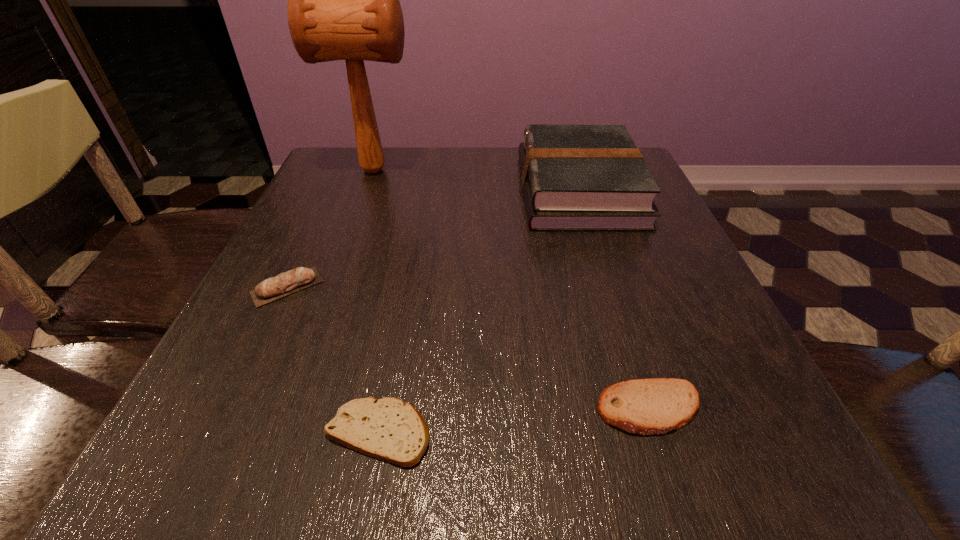
Where is `free spot located 0.260m on the spine side of the fourth shortest object`? This screenshot has height=540, width=960. free spot located 0.260m on the spine side of the fourth shortest object is located at coordinates (411, 190).

I want to click on vacant space located on the spine side of the fourth shortest object, so click(x=395, y=190).

Locate an element on the screen. The width and height of the screenshot is (960, 540). blank space located on the back of the third nearest object is located at coordinates (328, 199).

The height and width of the screenshot is (540, 960). Find the location of `vacant space located 0.230m on the left of the rightmost pita bread`. vacant space located 0.230m on the left of the rightmost pita bread is located at coordinates (430, 409).

At what (x,y) coordinates should I click in order to perform the action: click on vacant space located 0.280m on the right of the second pita bread from left to right. Please return your answer as a coordinate pair (x, y). Looking at the image, I should click on (642, 432).

Find the location of `mallet located at the far edge`. mallet located at the far edge is located at coordinates (343, 0).

Find the location of a particular element. The width and height of the screenshot is (960, 540). hardback book located in the far edge section of the desktop is located at coordinates (575, 177).

This screenshot has width=960, height=540. I want to click on mallet that is at the left edge, so click(343, 0).

This screenshot has width=960, height=540. Identify the location of pita bread that is at the left edge. (299, 278).

You are a GUI agent. You are given a task and a screenshot of the screen. Output one action in this format:
    pyautogui.click(x=<x>, y=<y>)
    Task: Click on the hardback book that is at the right edge
    
    Given the screenshot: What is the action you would take?
    pyautogui.click(x=575, y=177)